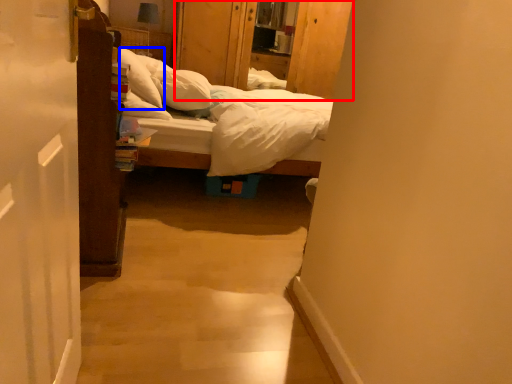
Question: Among these objects, which one is farthest to the camera, dresser (highlighted by a red box) or pillow (highlighted by a blue box)?

Choices:
 (A) dresser
 (B) pillow

Answer: (A)